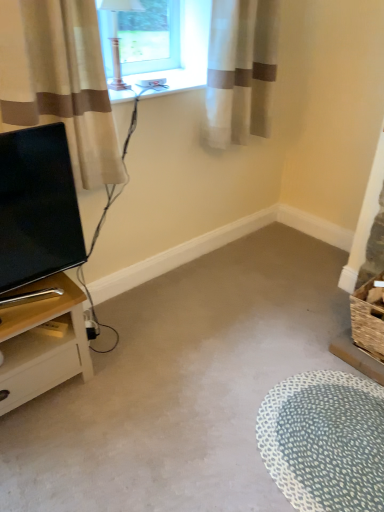
In order to face white dotted rug at lower right, should I rotate leftwards or rightwards?

Turn right approximately 18.495 degrees to face it.

Where is `light wood nightstand at left`? light wood nightstand at left is located at coordinates (42, 343).

The image size is (384, 512). Find the location of `beige fabric curtain at left, acting as the second curtain starting from the back`. beige fabric curtain at left, acting as the second curtain starting from the back is located at coordinates (60, 82).

Which object is more forward, white plastic window sill at upper center or matte black tv at left?

matte black tv at left.

Is white plastic window sill at upper center spatially inside matte black tv at left, or outside of it?

The correct answer is: outside.

Which is farther from the camera, [112,91] or [32,266]?

The point [112,91] is farther.

Is white plastic window sill at upper center oriented towards matte black tv at left?

No, white plastic window sill at upper center is not turned towards matte black tv at left.

Is beige fabric curtain at left, which appears as the 2th curtain when viewed from the right, aimed at light wood nightstand at left?

No, beige fabric curtain at left, which appears as the 2th curtain when viewed from the right, does not turn towards light wood nightstand at left.

Are beige fabric curtain at left, acting as the second curtain starting from the back, and light wood nightstand at left beside each other?

No, beige fabric curtain at left, acting as the second curtain starting from the back, is not touching light wood nightstand at left.

Is beige fabric curtain at left, the first curtain positioned from the front, at the right side of light wood nightstand at left?

Indeed, beige fabric curtain at left, the first curtain positioned from the front, is positioned on the right side of light wood nightstand at left.

From a real-world perspective, is white sheer curtain at upper right, which is counted as the 2th curtain, starting from the front, below beige fabric curtain at left, acting as the second curtain starting from the back?

Yes.

Is white sheer curtain at upper right, the 1th curtain when ordered from right to left, inside or outside of beige fabric curtain at left, the first curtain positioned from the front?

white sheer curtain at upper right, the 1th curtain when ordered from right to left, is located beyond the bounds of beige fabric curtain at left, the first curtain positioned from the front.

Consider the image. From the image's perspective, does white sheer curtain at upper right, the 1th curtain when ordered from right to left, appear lower than beige fabric curtain at left, which appears as the 2th curtain when viewed from the right?

Incorrect, from the image's perspective, white sheer curtain at upper right, the 1th curtain when ordered from right to left, is higher than beige fabric curtain at left, which appears as the 2th curtain when viewed from the right.

The width and height of the screenshot is (384, 512). In order to click on curtain behind the beige fabric curtain at left, acting as the second curtain starting from the back in this screenshot , I will do `click(241, 70)`.

Is light wood nightstand at left looking in the opposite direction of white sheer curtain at upper right, which is counted as the 2th curtain, starting from the front?

No, light wood nightstand at left is not facing away from white sheer curtain at upper right, which is counted as the 2th curtain, starting from the front.

Is light wood nightstand at left taller or shorter than white sheer curtain at upper right, the 1th curtain when ordered from right to left?

light wood nightstand at left is shorter than white sheer curtain at upper right, the 1th curtain when ordered from right to left.

I want to click on curtain behind the light wood nightstand at left, so click(241, 70).

Which object is thinner, matte black tv at left or beige fabric curtain at left, the first curtain positioned from the front?

With smaller width is matte black tv at left.

Measure the distance from matte black tv at left to beige fabric curtain at left, the first curtain positioned from the front.

matte black tv at left is 23.83 centimeters from beige fabric curtain at left, the first curtain positioned from the front.

Is matte black tv at left facing away from beige fabric curtain at left, acting as the second curtain starting from the back?

No, matte black tv at left is not facing away from beige fabric curtain at left, acting as the second curtain starting from the back.

At what (x,y) coordinates should I click in order to perform the action: click on television on the left of beige fabric curtain at left, the first curtain from the left. Please return your answer as a coordinate pair (x, y). The image size is (384, 512). Looking at the image, I should click on (37, 207).

Is matte black tv at left not near white dotted rug at lower right?

Yes, matte black tv at left and white dotted rug at lower right are located far from each other.

Locate an element on the screen. This screenshot has width=384, height=512. flat located behind the matte black tv at left is located at coordinates (325, 441).

Is matte black tv at left thinner than white dotted rug at lower right?

Yes, matte black tv at left is thinner than white dotted rug at lower right.

From the picture: Is matte black tv at left behind white dotted rug at lower right?

No, matte black tv at left is in front of white dotted rug at lower right.

Can you confirm if white dotted rug at lower right is taller than white plastic window sill at upper center?

No.

Is white dotted rug at lower right oriented away from white plastic window sill at upper center?

white dotted rug at lower right is not turned away from white plastic window sill at upper center.

The height and width of the screenshot is (512, 384). Identify the location of window sill that appears on the right of matte black tv at left. (166, 83).

What are the coordinates of `curtain that is the 2nd object above the light wood nightstand at left (from a real-world perspective)` in the screenshot? It's located at (60, 82).

Based on their spatial positions, is light wood nightstand at left or matte black tv at left further from white plastic window sill at upper center?

light wood nightstand at left is further to white plastic window sill at upper center.

From the picture: Estimate the real-world distances between objects in this image. Which object is closer to light wood nightstand at left, white sheer curtain at upper right, which is counted as the 2th curtain, starting from the front, or white dotted rug at lower right?

white dotted rug at lower right.

Considering their positions, is beige fabric curtain at left, the first curtain positioned from the front, positioned closer to light wood nightstand at left than white sheer curtain at upper right, the 2th curtain when ordered from left to right?

Among the two, beige fabric curtain at left, the first curtain positioned from the front, is located nearer to light wood nightstand at left.

From the picture: Looking at the image, which one is located further to white dotted rug at lower right, white plastic window sill at upper center or white sheer curtain at upper right, positioned as the 1th curtain in back-to-front order?

white plastic window sill at upper center is positioned further to the anchor white dotted rug at lower right.

Considering their positions, is beige fabric curtain at left, the first curtain positioned from the front, positioned closer to matte black tv at left than light wood nightstand at left?

The object closer to matte black tv at left is beige fabric curtain at left, the first curtain positioned from the front.

Estimate the real-world distances between objects in this image. Which object is further from carpet at center, light wood nightstand at left or white sheer curtain at upper right, which is counted as the 2th curtain, starting from the front?

The object further to carpet at center is white sheer curtain at upper right, which is counted as the 2th curtain, starting from the front.

Looking at this image, from the image, which object appears to be farther from beige fabric curtain at left, the first curtain from the left, carpet at center or matte black tv at left?

carpet at center lies further to beige fabric curtain at left, the first curtain from the left, than the other object.

Based on their spatial positions, is white plastic window sill at upper center or beige fabric curtain at left, which appears as the 2th curtain when viewed from the right, further from light wood nightstand at left?

Among the two, white plastic window sill at upper center is located further to light wood nightstand at left.

You are a GUI agent. You are given a task and a screenshot of the screen. Output one action in this format:
    pyautogui.click(x=<x>, y=<y>)
    Task: Click on the television between white sheer curtain at upper right, the 1th curtain when ordered from right to left, and light wood nightstand at left vertically
    
    Given the screenshot: What is the action you would take?
    pyautogui.click(x=37, y=207)

At what (x,y) coordinates should I click in order to perform the action: click on curtain between matte black tv at left and white sheer curtain at upper right, the 2th curtain when ordered from left to right. Please return your answer as a coordinate pair (x, y). This screenshot has width=384, height=512. Looking at the image, I should click on (60, 82).

You are a GUI agent. You are given a task and a screenshot of the screen. Output one action in this format:
    pyautogui.click(x=<x>, y=<y>)
    Task: Click on the plain located between light wood nightstand at left and white dotted rug at lower right in the left-right direction
    The height and width of the screenshot is (512, 384).
    Given the screenshot: What is the action you would take?
    pyautogui.click(x=182, y=385)

The width and height of the screenshot is (384, 512). In order to click on nightstand that lies between white plastic window sill at upper center and white dotted rug at lower right from top to bottom in this screenshot , I will do `click(42, 343)`.